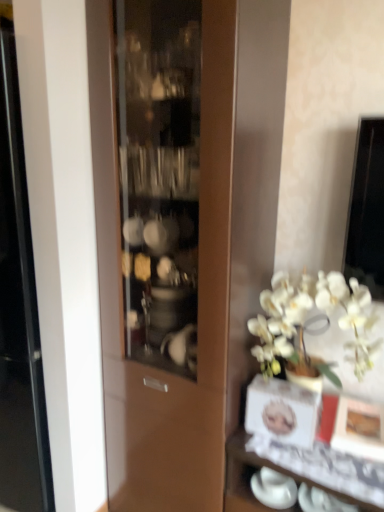
You are a GUI agent. You are given a task and a screenshot of the screen. Output one action in this format:
    pyautogui.click(x=<x>, y=<y>)
    Task: Click on the vacant region above white glossy vase at lower right (from a real-world perspective)
    
    Given the screenshot: What is the action you would take?
    pos(329,436)